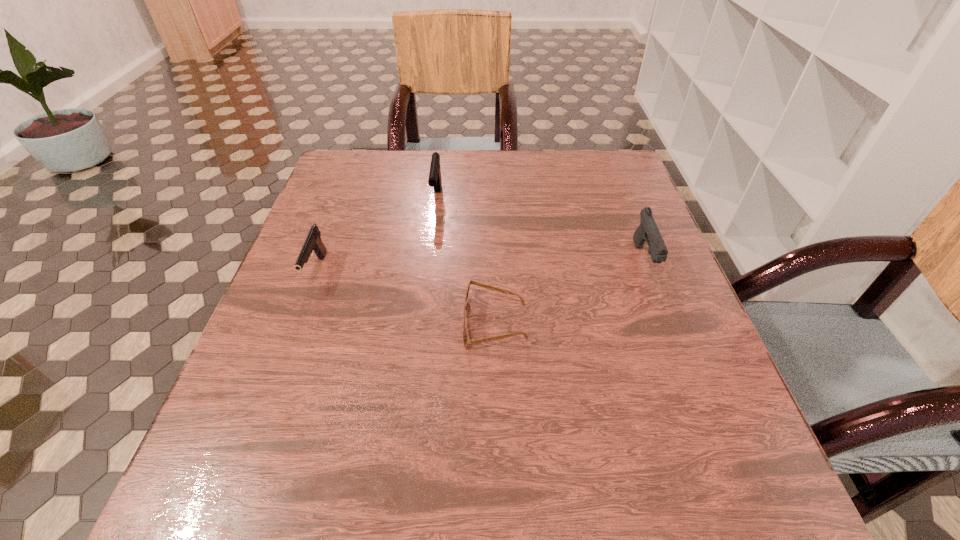
Where is `the farthest object`? the farthest object is located at coordinates tap(434, 180).

I want to click on the second pistol from left to right, so click(x=434, y=180).

Locate an element on the screen. The image size is (960, 540). the rightmost pistol is located at coordinates (648, 231).

Identify the location of the leftmost object. (313, 243).

Locate an element on the screen. This screenshot has height=540, width=960. the shortest pistol is located at coordinates (313, 243).

Identify the location of sunglasses. (466, 340).

Where is `the second object from right to left`? The image size is (960, 540). the second object from right to left is located at coordinates (466, 340).

Locate an element on the screen. This screenshot has width=960, height=540. free location located at the barrel of the farthest object is located at coordinates (430, 252).

At what (x,y) coordinates should I click in order to perform the action: click on free spot located at the barrel of the rightmost pistol. Please return your answer as a coordinate pair (x, y). Looking at the image, I should click on point(684,365).

Find the location of a particular element. The image size is (960, 540). vacant region located at the muzzle of the leftmost pistol is located at coordinates (277, 376).